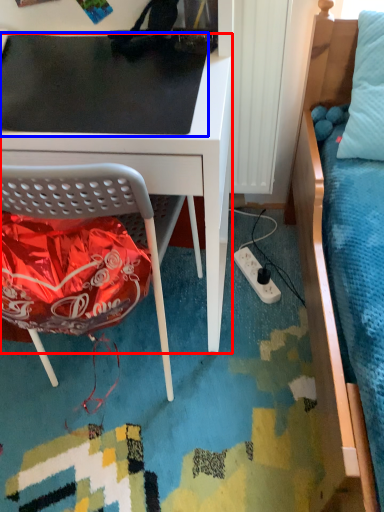
Question: Among these objects, which one is nearest to the camera, desk (highlighted by a red box) or table top (highlighted by a blue box)?

Choices:
 (A) desk
 (B) table top

Answer: (A)